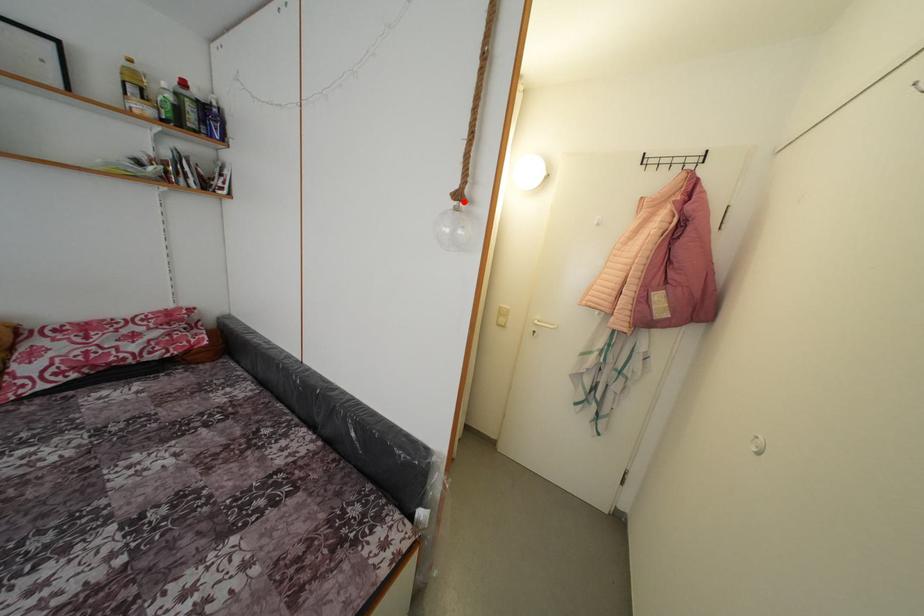
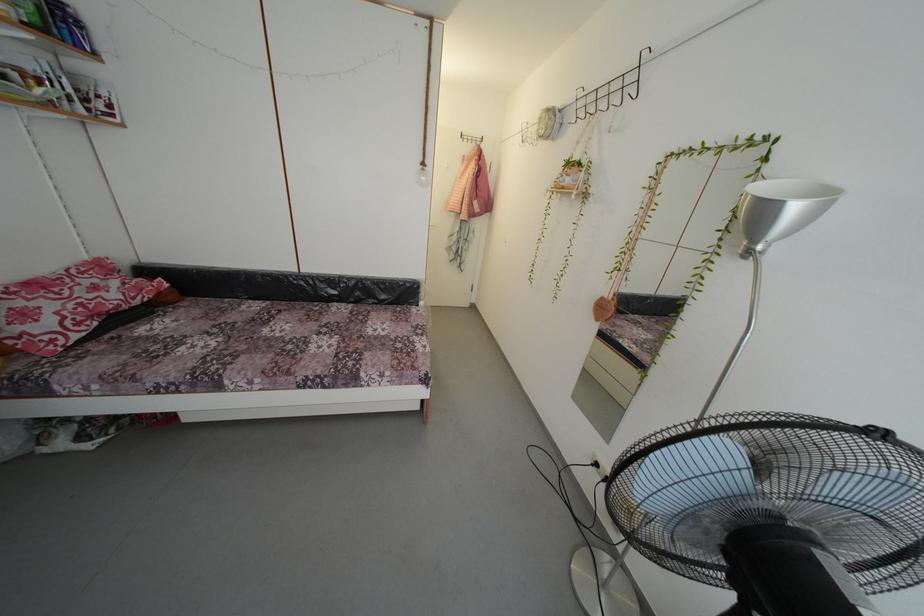
Find the pixel in the second image that matches the highlighted location in the first image.

(429, 169)